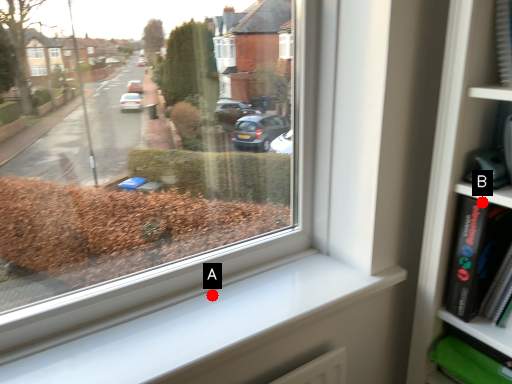
Question: Two points are circled on the image, labeled by A and B beside each circle. Which point is closer to the camera?

Choices:
 (A) A is closer
 (B) B is closer

Answer: (B)